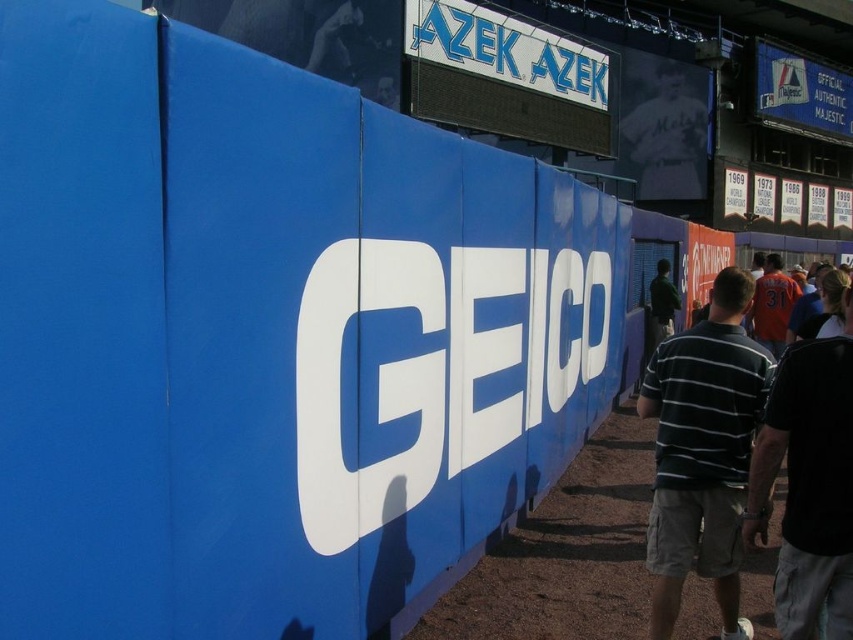
Does point (699, 77) lie in front of point (660, 260)?

No, (699, 77) is behind (660, 260).

Between white jersey at upper center and green matte shirt at center, which one appears on the right side from the viewer's perspective?

white jersey at upper center

You are a GUI agent. You are given a task and a screenshot of the screen. Output one action in this format:
    pyautogui.click(x=<x>, y=<y>)
    Task: Click on the white jersey at upper center
    The image size is (853, 640).
    Given the screenshot: What is the action you would take?
    pyautogui.click(x=663, y=125)

Identify the location of white jersey at upper center. The image size is (853, 640). (663, 125).

Does point (782, 596) lie behind point (663, 294)?

That is False.

From the picture: Does dark gray cotton shirt at right come in front of green matte shirt at center?

Yes, it is.

Which is in front, point (804, 474) or point (670, 328)?

Point (804, 474) is more forward.

Locate an element on the screen. Image resolution: width=853 pixels, height=640 pixels. dark gray cotton shirt at right is located at coordinates (809, 484).

Does point (531, 45) lie behind point (633, 176)?

No, (531, 45) is in front of (633, 176).

Is blue plastic sign at upper center bigger than white jersey at upper center?

Indeed, blue plastic sign at upper center has a larger size compared to white jersey at upper center.

Locate an element on the screen. The height and width of the screenshot is (640, 853). blue plastic sign at upper center is located at coordinates (505, 49).